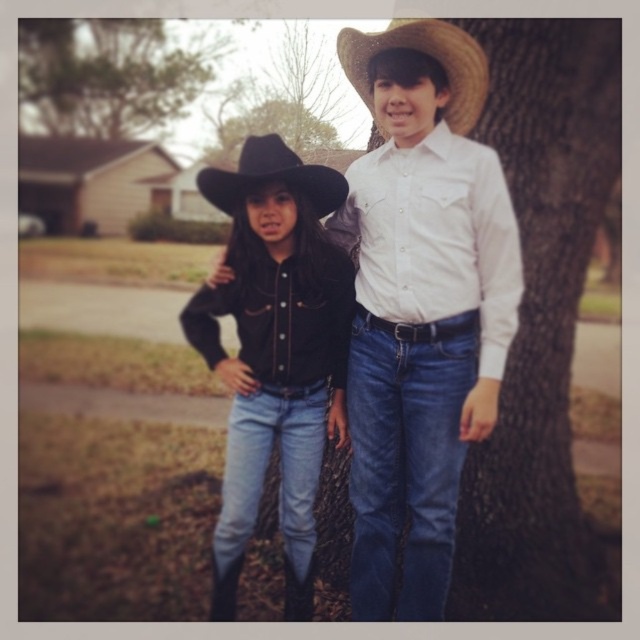
Is white matte shirt at center smaller than green leafy tree at upper left?

No, white matte shirt at center is not smaller than green leafy tree at upper left.

The height and width of the screenshot is (640, 640). In order to click on white matte shirt at center in this screenshot , I will do `click(420, 304)`.

Can you confirm if black matte cowboy hat at center is bigger than strawmaterial/texturecowboy hat at upper center?

Yes, black matte cowboy hat at center is bigger than strawmaterial/texturecowboy hat at upper center.

Between black matte cowboy hat at center and strawmaterial/texturecowboy hat at upper center, which one has more height?

Standing taller between the two is black matte cowboy hat at center.

Is point (307, 358) closer to viewer compared to point (456, 74)?

No, (307, 358) is further to viewer.

Locate an element on the screen. Image resolution: width=640 pixels, height=640 pixels. black matte cowboy hat at center is located at coordinates (275, 352).

Is white matte shirt at center shorter than strawmaterial/texturecowboy hat at upper center?

No.

Is white matte shirt at center wider than strawmaterial/texturecowboy hat at upper center?

Yes.

Which is behind, point (376, 115) or point (465, 70)?

The point (376, 115) is behind.

This screenshot has width=640, height=640. Identify the location of white matte shirt at center. (420, 304).